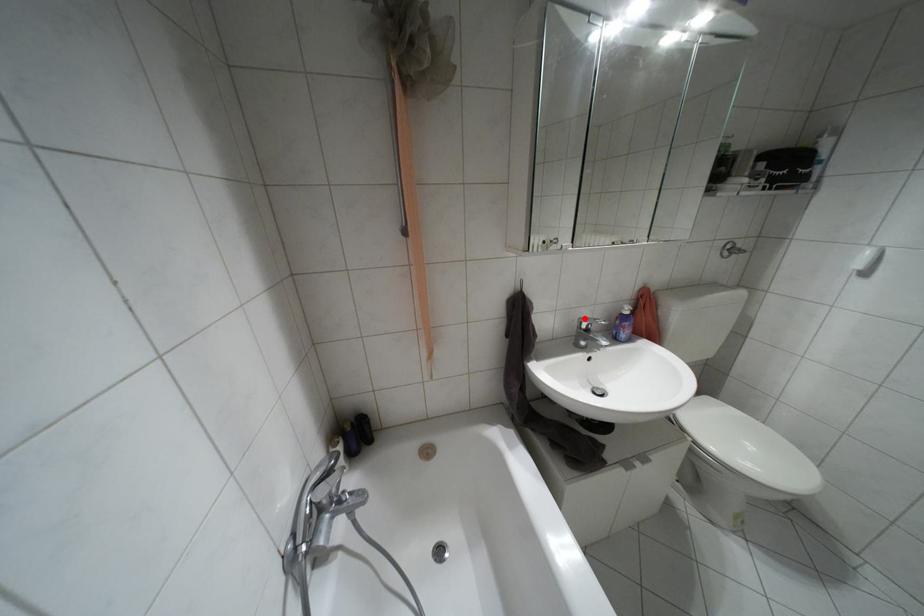
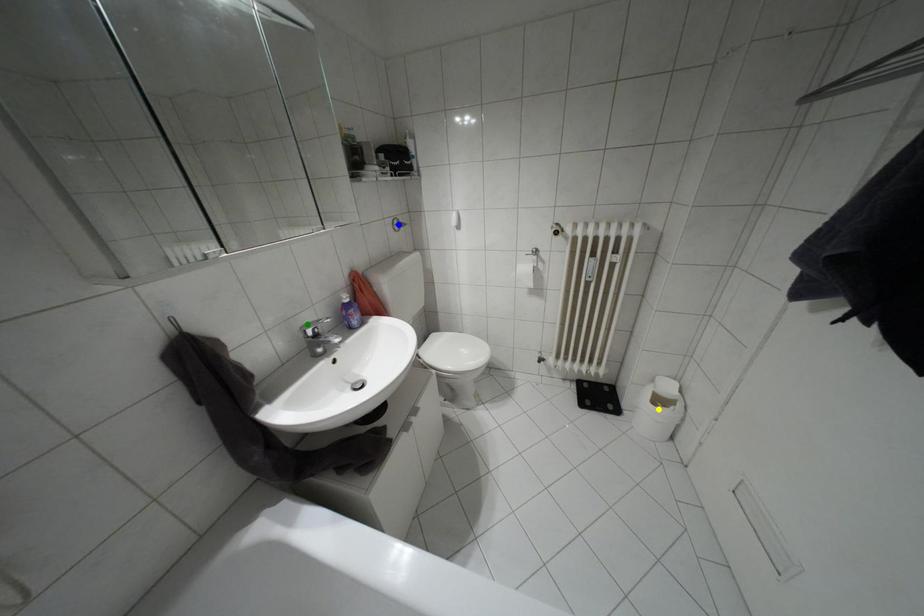
Question: I am providing you with two images of the same scene from different viewpoints. A red point is marked on the first image. You are given multiple points on the second image. Which spot in image 2 lines up with the point in image 1?

Choices:
 (A) green point
 (B) yellow point
 (C) blue point

Answer: (A)